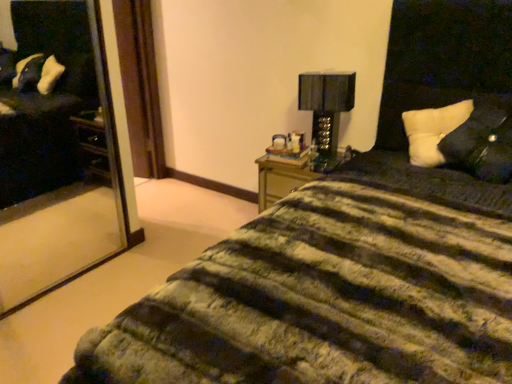
Question: Is black glossy table lamp at upper right not near white soft pillow at upper right, which is the second pillow from front to back?

Choices:
 (A) no
 (B) yes

Answer: (A)

Question: Is black glossy table lamp at upper right thinner than white soft pillow at upper right, which is the second pillow from front to back?

Choices:
 (A) no
 (B) yes

Answer: (B)

Question: Is the position of black glossy table lamp at upper right more distant than that of white soft pillow at upper right, the first pillow when ordered from back to front?

Choices:
 (A) yes
 (B) no

Answer: (A)

Question: Can you see black glossy table lamp at upper right touching white soft pillow at upper right, which is the second pillow from front to back?

Choices:
 (A) no
 (B) yes

Answer: (A)

Question: Is black glossy table lamp at upper right smaller than white soft pillow at upper right, the first pillow when ordered from back to front?

Choices:
 (A) yes
 (B) no

Answer: (A)

Question: Is black glossy table lamp at upper right in front of or behind white soft pillow at right, placed as the 2th pillow when sorted from back to front, in the image?

Choices:
 (A) front
 (B) behind

Answer: (B)

Question: From the image's perspective, is black glossy table lamp at upper right located above or below white soft pillow at right, placed as the 2th pillow when sorted from back to front?

Choices:
 (A) above
 (B) below

Answer: (A)

Question: Do you think black glossy table lamp at upper right is within white soft pillow at right, placed as the 2th pillow when sorted from back to front, or outside of it?

Choices:
 (A) outside
 (B) inside

Answer: (A)

Question: In terms of height, does black glossy table lamp at upper right look taller or shorter compared to white soft pillow at right, placed as the 2th pillow when sorted from back to front?

Choices:
 (A) short
 (B) tall

Answer: (B)

Question: Based on their sizes in the image, would you say white soft pillow at upper right, which is the second pillow from front to back, is bigger or smaller than black glossy table lamp at upper right?

Choices:
 (A) small
 (B) big

Answer: (B)

Question: In the image, is white soft pillow at upper right, the first pillow when ordered from back to front, on the left side or the right side of black glossy table lamp at upper right?

Choices:
 (A) left
 (B) right

Answer: (B)

Question: Does point (436, 139) appear closer or farther from the camera than point (305, 77)?

Choices:
 (A) farther
 (B) closer

Answer: (B)

Question: Looking at their shapes, would you say white soft pillow at upper right, the first pillow when ordered from back to front, is wider or thinner than black glossy table lamp at upper right?

Choices:
 (A) thin
 (B) wide

Answer: (B)

Question: From a real-world perspective, is white soft pillow at upper right, which is the second pillow from front to back, positioned above or below white soft pillow at right, placed as the 2th pillow when sorted from back to front?

Choices:
 (A) below
 (B) above

Answer: (A)

Question: Based on their sizes in the image, would you say white soft pillow at upper right, which is the second pillow from front to back, is bigger or smaller than white soft pillow at right, which appears as the 1th pillow when viewed from the front?

Choices:
 (A) small
 (B) big

Answer: (A)